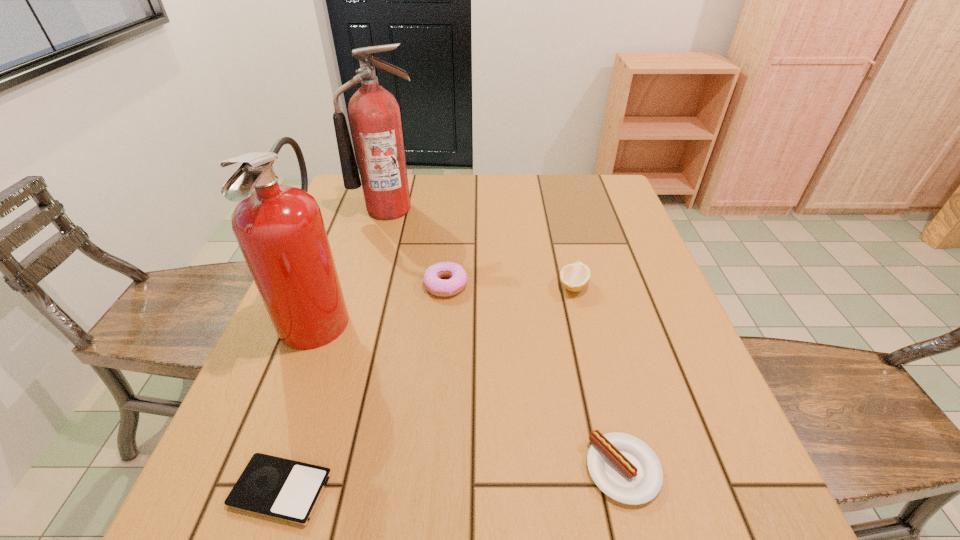
Find the location of a particular element. free space between the doughnut and the second shortest object is located at coordinates (535, 376).

The width and height of the screenshot is (960, 540). What are the coordinates of `free spot between the lemon and the sausage` in the screenshot? It's located at (598, 377).

The width and height of the screenshot is (960, 540). I want to click on free space between the fifth tallest object and the nearer fire extinguisher, so click(470, 391).

Locate an element on the screen. The width and height of the screenshot is (960, 540). free space between the farthest object and the shortest object is located at coordinates (335, 349).

Where is `vacant region between the doughnut and the lemon`? The image size is (960, 540). vacant region between the doughnut and the lemon is located at coordinates (510, 285).

Select which object is the third closest to the shortest object. Please provide its 2D coordinates. Your answer should be formatted as a tuple, i.e. [(x, y)], where the tuple contains the x and y coordinates of a point satisfying the conditions above.

[(626, 469)]

Select which object is the closest to the third object from right to left. Please provide its 2D coordinates. Your answer should be formatted as a tuple, i.e. [(x, y)], where the tuple contains the x and y coordinates of a point satisfying the conditions above.

[(280, 230)]

The image size is (960, 540). What are the coordinates of `free location that satisfies the following two spatial constraints: 1. on the front of the farther fire extinguisher near the operation label; 2. on the right side of the doughnut` in the screenshot? It's located at (367, 284).

You are a GUI agent. You are given a task and a screenshot of the screen. Output one action in this format:
    pyautogui.click(x=<x>, y=<y>)
    Task: Click on the free point that satisfies the following two spatial constraints: 1. on the back side of the lemon; 2. on the right side of the shortest object
    
    Given the screenshot: What is the action you would take?
    [348, 286]

At what (x,y) coordinates should I click in order to perform the action: click on free location that satisfies the following two spatial constraints: 1. with the handle and nozzle on the nearer fire extinguisher; 2. on the back side of the shortest object. Please return your answer as a coordinate pair (x, y). The image size is (960, 540). Looking at the image, I should click on (250, 490).